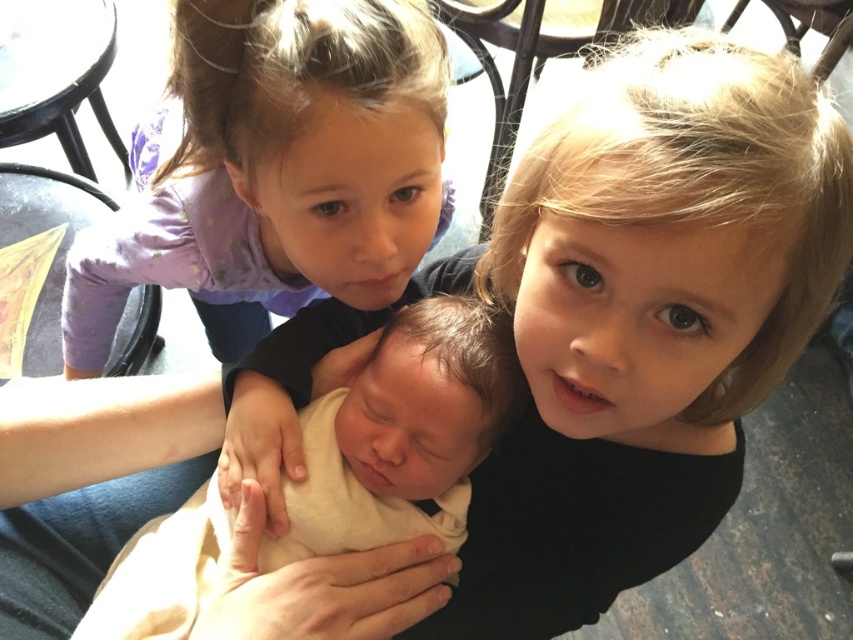
You are a photographer setting up for a family photo. You need to position a purple fabric at upper left and a soft cream fabric newborn at center so that the purple fabric is wider than the newborn. Given the current setup, is the purple fabric already wider than the newborn?

The purple fabric at upper left is wider than the soft cream fabric newborn at center, so yes, the purple fabric is already wider than the newborn in the current setup.

You are a photographer trying to capture the purple fabric at upper left in the scene. The camera focuses on the point at coordinates point (277, 172). Will this point be on the purple fabric at upper left?

Yes, the point (277, 172) is on the purple fabric at upper left, so the camera will focus on the purple fabric at upper left.

You are standing in the room and want to locate the purple fabric at upper left. What are the coordinates where you can find it?

The purple fabric at upper left is located at coordinates point (277, 172).